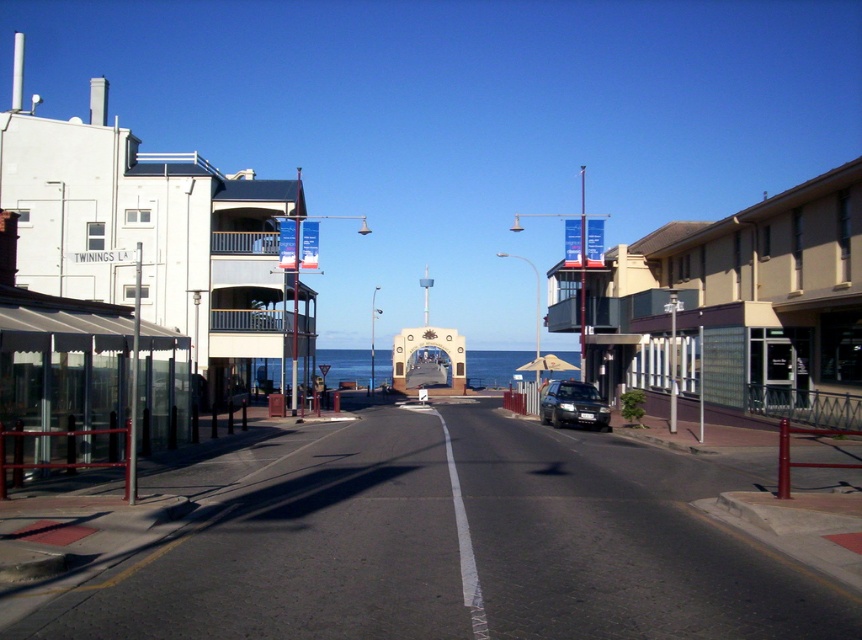
You are a tourist standing at the end of the street looking towards the coastal area. You see the beige concrete building at right and the satin silver sedan at center. Which object appears larger in the scene?

The beige concrete building at right appears larger than the satin silver sedan at center in the scene.

You are standing on the street scene leading towards a coastal area and see two points marked on the image. The first point is at coordinates point [636,326] and the second is at point [558,394]. Which point is closer to you?

Point [636,326] is further to the camera than point [558,394], so the second point is closer to you.

You are driving a sedan that is 1.5 meters tall. You need to pass under a low bridge ahead. The beige concrete building at right and the satin silver sedan at center are in your path. Which object will you hit first if you proceed?

The satin silver sedan at center is shorter than the beige concrete building at right, so you will hit the satin silver sedan at center first if you proceed.